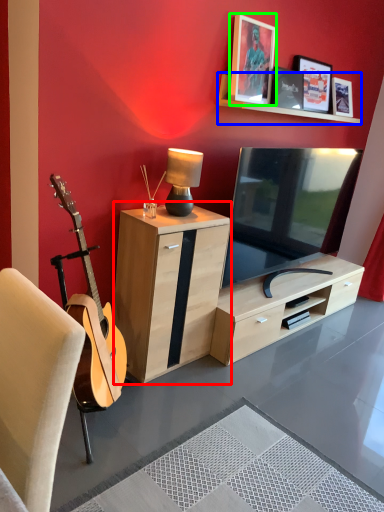
Question: Which is nearer to the cabinetry (highlighted by a red box)? shelf (highlighted by a blue box) or picture frame (highlighted by a green box).

Choices:
 (A) shelf
 (B) picture frame

Answer: (B)